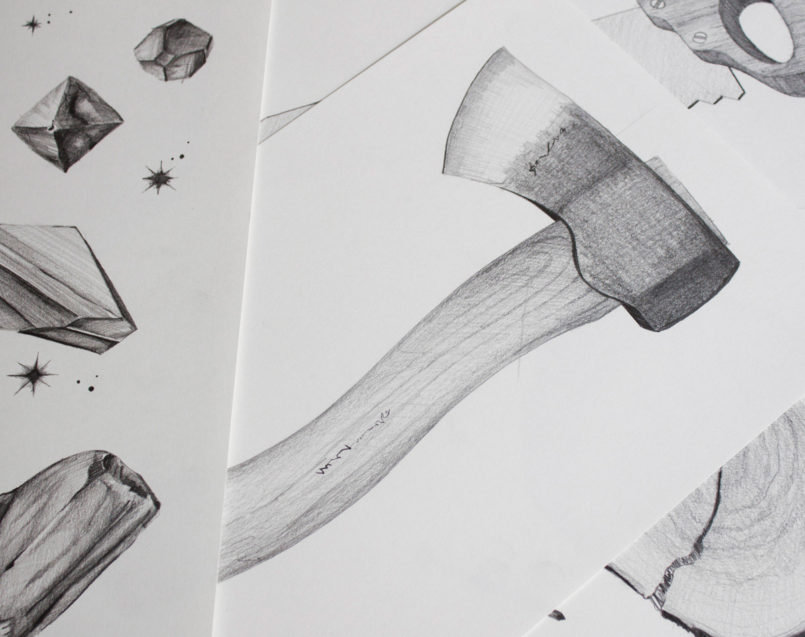
Image resolution: width=805 pixels, height=637 pixels. In order to click on crack in wood in this screenshot , I will do `click(695, 552)`.